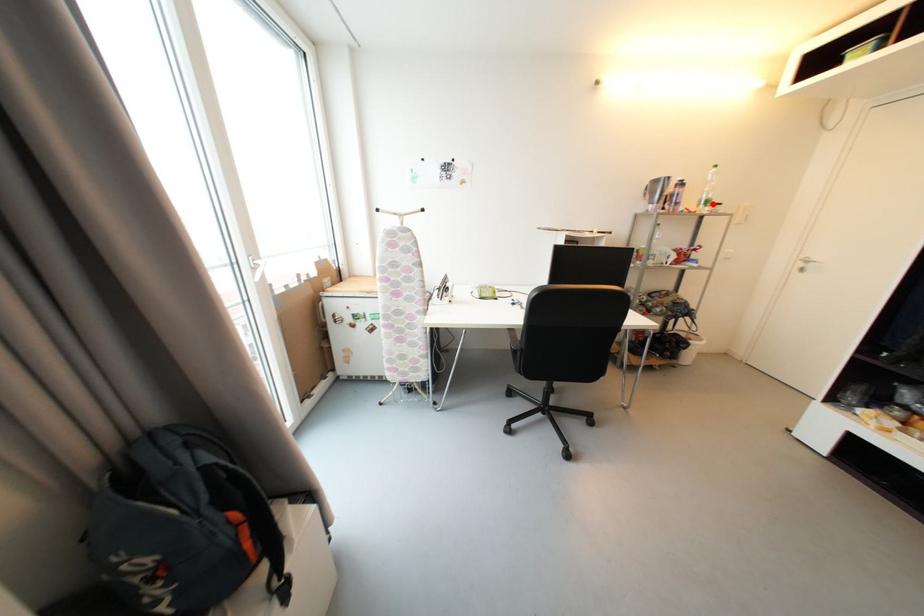
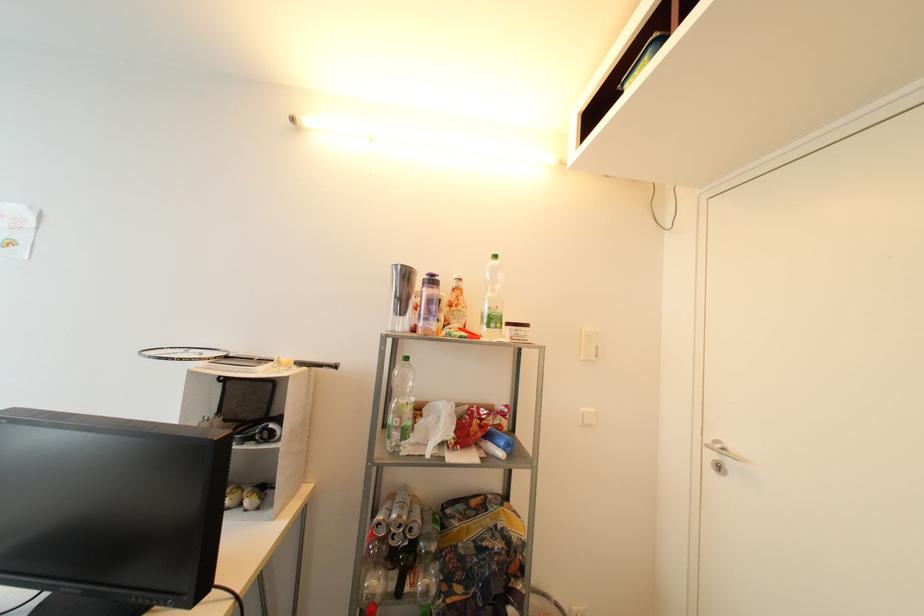
The point at the highlighted location is marked in the first image. Where is the corresponding point in the second image?

(499, 322)